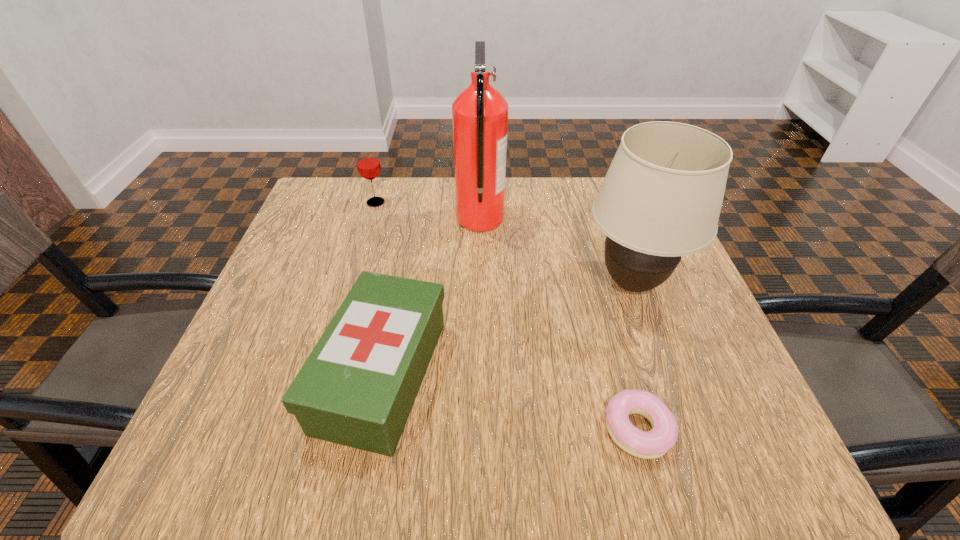
The width and height of the screenshot is (960, 540). I want to click on the tallest object, so click(479, 113).

Locate an element on the screen. the third object from left to right is located at coordinates (479, 113).

You are a GUI agent. You are given a task and a screenshot of the screen. Output one action in this format:
    pyautogui.click(x=<x>, y=<y>)
    Task: Click on the second tallest object
    The height and width of the screenshot is (540, 960).
    Given the screenshot: What is the action you would take?
    pyautogui.click(x=661, y=198)

Locate an element on the screen. The width and height of the screenshot is (960, 540). glass is located at coordinates click(x=368, y=164).

I want to click on the first-aid kit, so click(357, 387).

The width and height of the screenshot is (960, 540). Identify the location of doughnut. (655, 443).

At what (x,y) coordinates should I click in order to perform the action: click on vacant space positioned 0.060m at the nozzle of the third object from right to left. Please return your answer as a coordinate pair (x, y). Looking at the image, I should click on (433, 219).

Identify the location of vacant position located 0.370m at the nozzle of the third object from right to left. (309, 219).

Locate an element on the screen. vacant space situated 0.380m at the nozzle of the third object from right to left is located at coordinates (305, 219).

Find the location of a particular element. This screenshot has height=540, width=960. vacant space located on the back of the second tallest object is located at coordinates (603, 200).